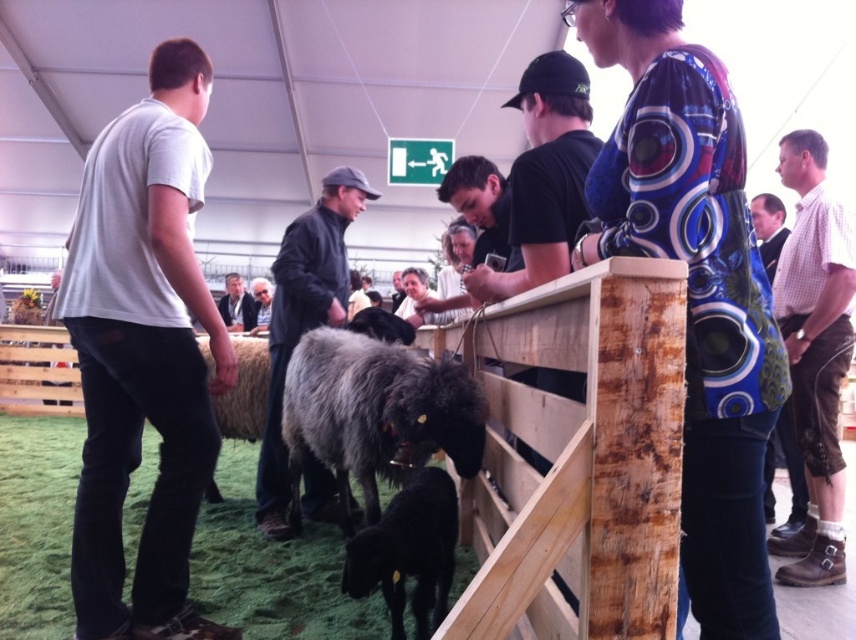
Does white matte shirt at left have a larger size compared to light brown leather jacket at upper right?

No.

Which of these two, white matte shirt at left or light brown leather jacket at upper right, stands shorter?

light brown leather jacket at upper right is shorter.

Who is more forward, (62, 310) or (776, 243)?

Point (62, 310)

Locate an element on the screen. This screenshot has height=640, width=856. white matte shirt at left is located at coordinates [143, 353].

Locate an element on the screen. dark gray leather jacket at center is located at coordinates (302, 317).

Does point (296, 230) come closer to viewer compared to point (367, 547)?

No, (296, 230) is further to viewer.

Identify the location of dark gray leather jacket at center. (302, 317).

Which is above, blue fabric bag at right or gray woolen jacket at center?

Positioned higher is gray woolen jacket at center.

Can you confirm if blue fabric bag at right is taller than gray woolen jacket at center?

Yes, blue fabric bag at right is taller than gray woolen jacket at center.

Does point (768, 464) come farther from viewer compared to point (251, 333)?

No, it is in front of (251, 333).

The height and width of the screenshot is (640, 856). I want to click on blue fabric bag at right, so point(788,474).